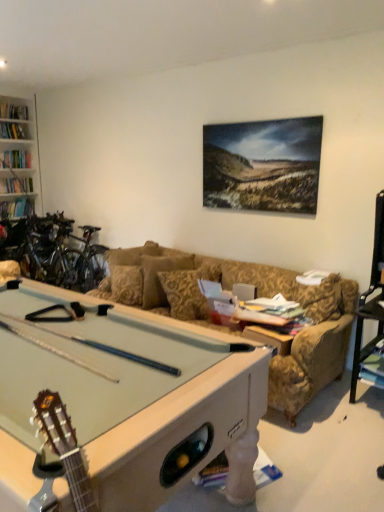
Question: Is shiny metallic bicycles at left at the right side of gold floral-patterned pillow at center?

Choices:
 (A) yes
 (B) no

Answer: (B)

Question: Would you say shiny metallic bicycles at left is a long distance from gold floral-patterned pillow at center?

Choices:
 (A) no
 (B) yes

Answer: (B)

Question: Is shiny metallic bicycles at left in contact with gold floral-patterned pillow at center?

Choices:
 (A) yes
 (B) no

Answer: (B)

Question: Is shiny metallic bicycles at left oriented away from gold floral-patterned pillow at center?

Choices:
 (A) yes
 (B) no

Answer: (B)

Question: Is shiny metallic bicycles at left further to camera compared to gold floral-patterned pillow at center?

Choices:
 (A) yes
 (B) no

Answer: (A)

Question: Considering the relative sizes of shiny metallic bicycles at left and gold floral-patterned pillow at center in the image provided, is shiny metallic bicycles at left shorter than gold floral-patterned pillow at center?

Choices:
 (A) yes
 (B) no

Answer: (B)

Question: Considering the relative sizes of gold floral-patterned pillow at center and light green felt pool table at lower left in the image provided, is gold floral-patterned pillow at center smaller than light green felt pool table at lower left?

Choices:
 (A) yes
 (B) no

Answer: (A)

Question: From a real-world perspective, does gold floral-patterned pillow at center sit lower than light green felt pool table at lower left?

Choices:
 (A) yes
 (B) no

Answer: (B)

Question: Considering the relative sizes of gold floral-patterned pillow at center and light green felt pool table at lower left in the image provided, is gold floral-patterned pillow at center bigger than light green felt pool table at lower left?

Choices:
 (A) no
 (B) yes

Answer: (A)

Question: Is gold floral-patterned pillow at center located outside light green felt pool table at lower left?

Choices:
 (A) no
 (B) yes

Answer: (B)

Question: Is the position of gold floral-patterned pillow at center more distant than that of light green felt pool table at lower left?

Choices:
 (A) no
 (B) yes

Answer: (B)

Question: Is gold floral-patterned pillow at center to the left of light green felt pool table at lower left from the viewer's perspective?

Choices:
 (A) yes
 (B) no

Answer: (B)

Question: Can you confirm if light green felt pool table at lower left is wider than shiny metallic bicycles at left?

Choices:
 (A) yes
 (B) no

Answer: (A)